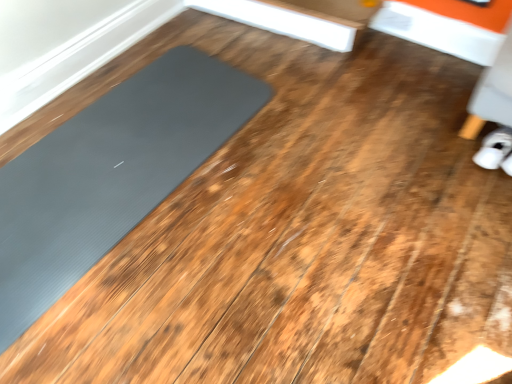
Measure the distance between white fabric shoe at lower right and camera.

1.68 meters.

The height and width of the screenshot is (384, 512). What do you see at coordinates (494, 149) in the screenshot?
I see `white fabric shoe at lower right` at bounding box center [494, 149].

At what (x,y) coordinates should I click in order to perform the action: click on white fabric shoe at lower right. Please return your answer as a coordinate pair (x, y). Looking at the image, I should click on (494, 149).

What is the approximate height of white fabric shoe at lower right?

white fabric shoe at lower right is 5.52 inches in height.

Locate an element on the screen. The width and height of the screenshot is (512, 384). gray rubber mat at left is located at coordinates (110, 174).

This screenshot has height=384, width=512. What do you see at coordinates (110, 174) in the screenshot?
I see `gray rubber mat at left` at bounding box center [110, 174].

Locate an element on the screen. white fabric shoe at lower right is located at coordinates (494, 149).

Considering the relative positions of gray rubber mat at left and white fabric shoe at lower right in the image provided, is gray rubber mat at left to the left or to the right of white fabric shoe at lower right?

From the image, it's evident that gray rubber mat at left is to the left of white fabric shoe at lower right.

Is gray rubber mat at left positioned in front of white fabric shoe at lower right?

Yes, it is in front of white fabric shoe at lower right.

Is point (119, 212) farther from camera compared to point (508, 169)?

No.

From the image's perspective, which is below, gray rubber mat at left or white fabric shoe at lower right?

gray rubber mat at left, from the image's perspective.

From a real-world perspective, which object rests below the other?

gray rubber mat at left is physically lower.

Which object is wider, gray rubber mat at left or white fabric shoe at lower right?

gray rubber mat at left is wider.

Considering the relative sizes of gray rubber mat at left and white fabric shoe at lower right in the image provided, is gray rubber mat at left taller than white fabric shoe at lower right?

No.

Does gray rubber mat at left have a smaller size compared to white fabric shoe at lower right?

No, gray rubber mat at left is not smaller than white fabric shoe at lower right.

Which is correct: gray rubber mat at left is inside white fabric shoe at lower right, or outside of it?

gray rubber mat at left exists outside the volume of white fabric shoe at lower right.

Is gray rubber mat at left touching white fabric shoe at lower right?

They are not placed beside each other.

Is white fabric shoe at lower right at the back of gray rubber mat at left?

No, gray rubber mat at left's orientation is not away from white fabric shoe at lower right.

What's the angular difference between gray rubber mat at left and white fabric shoe at lower right's facing directions?

The angle between the facing direction of gray rubber mat at left and the facing direction of white fabric shoe at lower right is 172 degrees.

At what (x,y) coordinates should I click in order to perform the action: click on mat that is in front of the white fabric shoe at lower right. Please return your answer as a coordinate pair (x, y). The height and width of the screenshot is (384, 512). Looking at the image, I should click on (110, 174).

Considering the positions of objects white fabric shoe at lower right and gray rubber mat at left in the image provided, who is more to the right, white fabric shoe at lower right or gray rubber mat at left?

white fabric shoe at lower right.

Between white fabric shoe at lower right and gray rubber mat at left, which one is positioned behind?

Positioned behind is white fabric shoe at lower right.

Considering the positions of point (499, 153) and point (65, 263), is point (499, 153) closer or farther from the camera than point (65, 263)?

Point (499, 153).

From the picture: From the image's perspective, is white fabric shoe at lower right located above or below gray rubber mat at left?

Based on their image positions, white fabric shoe at lower right is located above gray rubber mat at left.

From a real-world perspective, is white fabric shoe at lower right physically below gray rubber mat at left?

No, from a real-world perspective, white fabric shoe at lower right is not beneath gray rubber mat at left.

Is white fabric shoe at lower right thinner than gray rubber mat at left?

Correct, the width of white fabric shoe at lower right is less than that of gray rubber mat at left.

Does white fabric shoe at lower right have a greater height compared to gray rubber mat at left?

Correct, white fabric shoe at lower right is much taller as gray rubber mat at left.

Which of these two, white fabric shoe at lower right or gray rubber mat at left, is smaller?

Smaller between the two is white fabric shoe at lower right.

Could gray rubber mat at left be considered to be inside white fabric shoe at lower right?

No, gray rubber mat at left is not a part of white fabric shoe at lower right.

Is white fabric shoe at lower right positioned far away from gray rubber mat at left?

Yes, white fabric shoe at lower right is far from gray rubber mat at left.

Is gray rubber mat at left at the back of white fabric shoe at lower right?

That's not correct — white fabric shoe at lower right is not looking away from gray rubber mat at left.

Can you tell me how much white fabric shoe at lower right and gray rubber mat at left differ in facing direction?

They differ by 172 degrees in their facing directions.

This screenshot has height=384, width=512. In order to click on mat located below the white fabric shoe at lower right (from the image's perspective) in this screenshot , I will do `click(110, 174)`.

Identify the location of mat below the white fabric shoe at lower right (from a real-world perspective). This screenshot has height=384, width=512. (110, 174).

Identify the location of mat in front of the white fabric shoe at lower right. Image resolution: width=512 pixels, height=384 pixels. (110, 174).